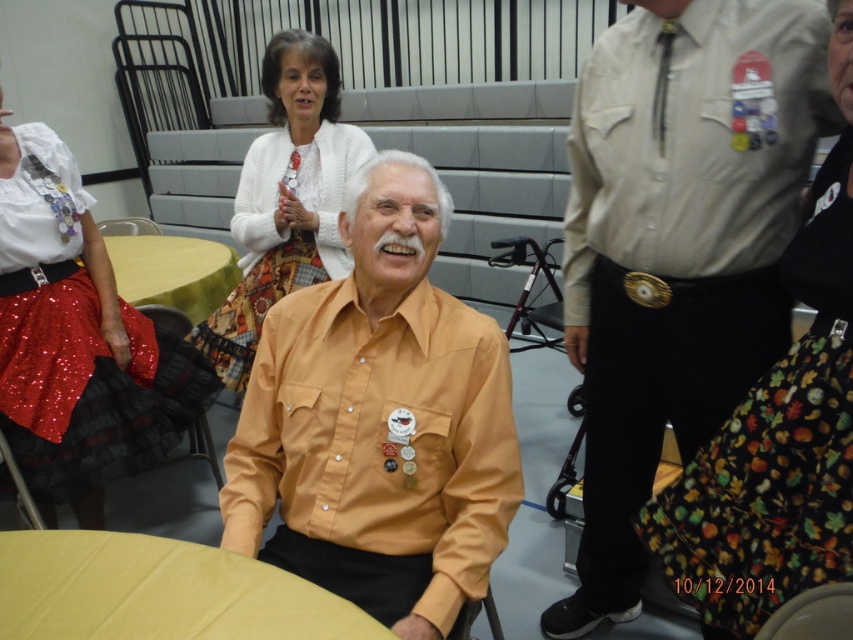
You are standing at the entrance of the hall and want to see the man in the white knitted sweater at upper center. Is the wooden chair at center blocking your view of him?

The white knitted sweater at upper center is in front of the wooden chair at center, so the chair is not blocking the view of the man in the white knitted sweater at upper center.

Consider the image. You are organizing a clothing donation drive and need to categorize items based on their size. You have two items to sort today. The first is a beige cotton shirt at upper right, and the second is a white knitted sweater at upper center. Which of these two items is narrower?

The beige cotton shirt at upper right is narrower than the white knitted sweater at upper center because the beige cotton shirt at upper right has a smaller width.